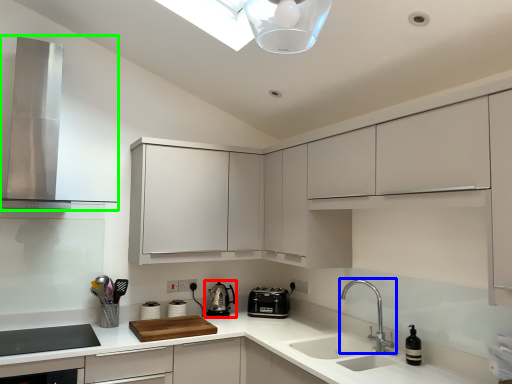
Question: Based on their relative distances, which object is farther from kitchen appliance (highlighted by a red box)? Choose from tap (highlighted by a blue box) and home appliance (highlighted by a green box).

Choices:
 (A) tap
 (B) home appliance

Answer: (B)